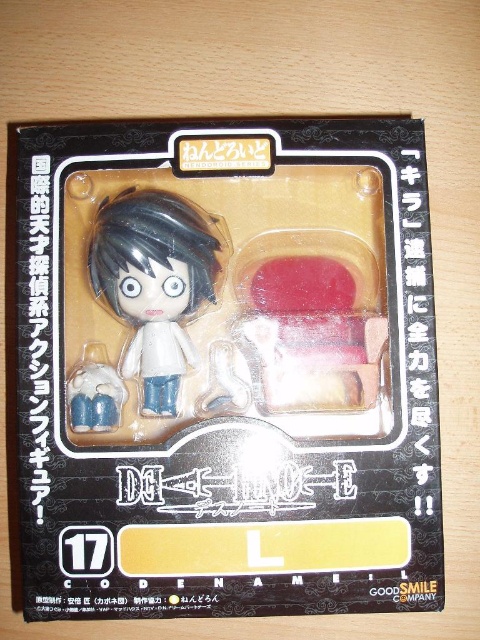
You are organizing a display shelf for a toy store. You have a matte black action figure at center and a matte white doll at center. According to the packaging, which item should be placed lower on the shelf to match the original packaging arrangement?

The matte black action figure at center should be placed lower on the shelf since it is positioned below the matte white doll at center in the original packaging.

You are a collector who wants to display the matte black action figure at center and the matte white figure at lower left on a shelf. Which one should you place first if you want the taller one to be in the middle?

You should place the matte black action figure at center first because it is taller than the matte white figure at lower left, so placing it in the middle will ensure it stands out more.